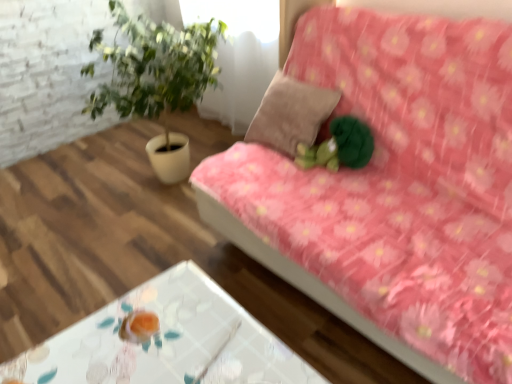
Question: From the image's perspective, relative to suede-like beige pillow at center, is pink floral fabric couch at upper right above or below?

Choices:
 (A) above
 (B) below

Answer: (B)

Question: In terms of size, does pink floral fabric couch at upper right appear bigger or smaller than suede-like beige pillow at center?

Choices:
 (A) big
 (B) small

Answer: (A)

Question: Which object is the farthest from the green plush toy at center?

Choices:
 (A) pink floral fabric couch at upper right
 (B) transparent glass table at lower center
 (C) suede-like beige pillow at center

Answer: (B)

Question: Which object is the farthest from the transparent glass table at lower center?

Choices:
 (A) suede-like beige pillow at center
 (B) green plush toy at center
 (C) pink floral fabric couch at upper right

Answer: (A)